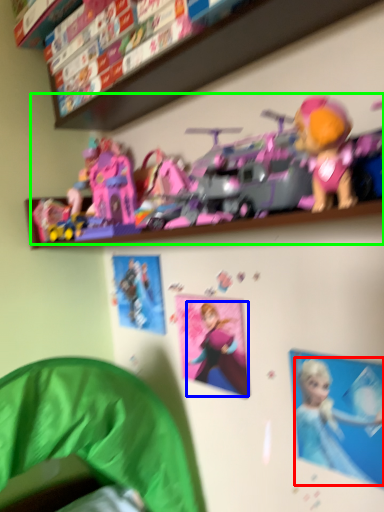
Question: Which is nearer to the person (highlighted by a red box)? toy (highlighted by a blue box) or toy (highlighted by a green box).

Choices:
 (A) toy
 (B) toy

Answer: (A)